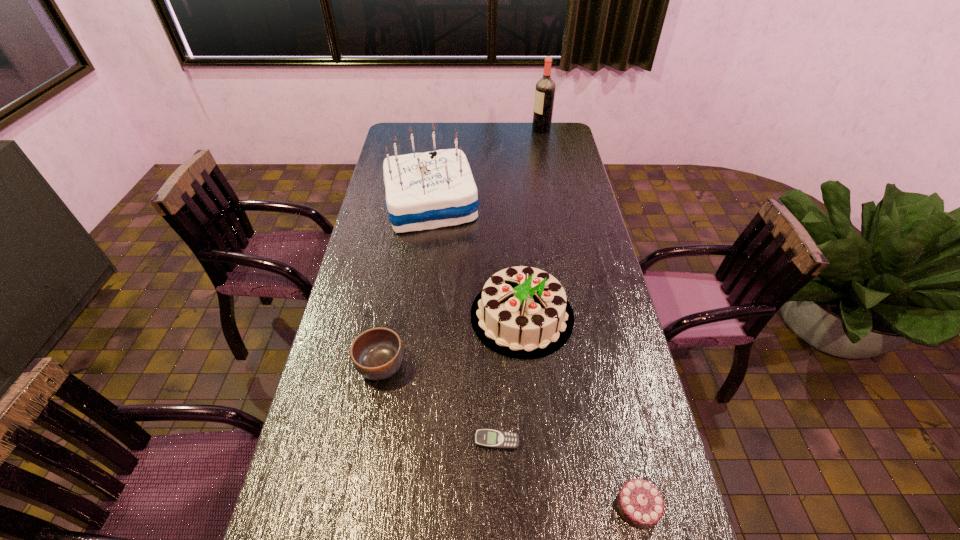
This screenshot has width=960, height=540. In order to click on vacant area that lies between the fifth nearest object and the shortest object in this screenshot , I will do click(464, 323).

Identify the location of free space between the beeper and the chocolate cake. The height and width of the screenshot is (540, 960). (567, 474).

Where is `blank region between the nearer birthday cake and the chocolate cake`? The height and width of the screenshot is (540, 960). blank region between the nearer birthday cake and the chocolate cake is located at coordinates (580, 411).

The image size is (960, 540). I want to click on free spot between the fourth tallest object and the liquor, so click(461, 248).

Where is `unoccupied position between the fourth tallest object and the tallest object`? unoccupied position between the fourth tallest object and the tallest object is located at coordinates (461, 248).

Identify the location of the closest object relative to the second nearest object. This screenshot has height=540, width=960. 522,312.

Locate an element on the screen. This screenshot has height=540, width=960. object that is the fifth closest to the bowl is located at coordinates (545, 88).

The width and height of the screenshot is (960, 540). I want to click on free spot that satisfies the following two spatial constraints: 1. on the back side of the nearest object; 2. on the front-facing side of the tallest object, so click(x=551, y=129).

I want to click on vacant space that satisfies the following two spatial constraints: 1. on the front side of the second shortest object; 2. on the left side of the third shortest object, so click(356, 507).